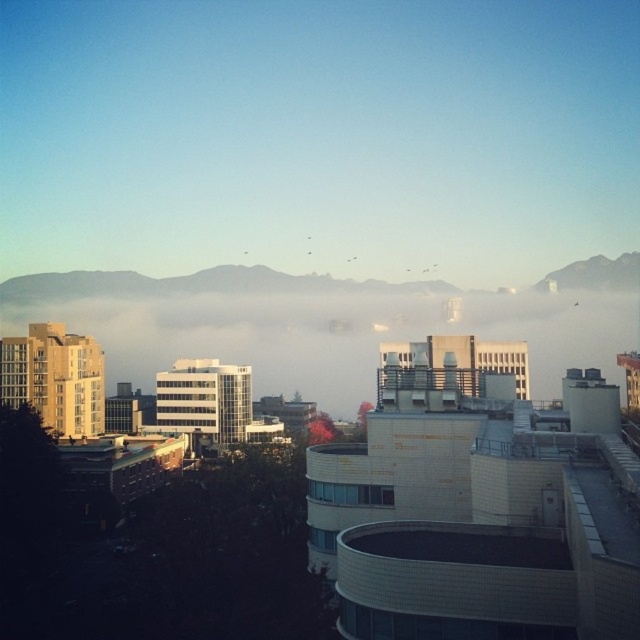
Image resolution: width=640 pixels, height=640 pixels. Describe the element at coordinates (314, 324) in the screenshot. I see `white fluffy morning fog at center` at that location.

Can you confirm if white fluffy morning fog at center is wider than rocky gray mountain at upper right?

Yes, white fluffy morning fog at center is wider than rocky gray mountain at upper right.

The height and width of the screenshot is (640, 640). Describe the element at coordinates (314, 324) in the screenshot. I see `white fluffy morning fog at center` at that location.

Image resolution: width=640 pixels, height=640 pixels. I want to click on white fluffy morning fog at center, so click(x=314, y=324).